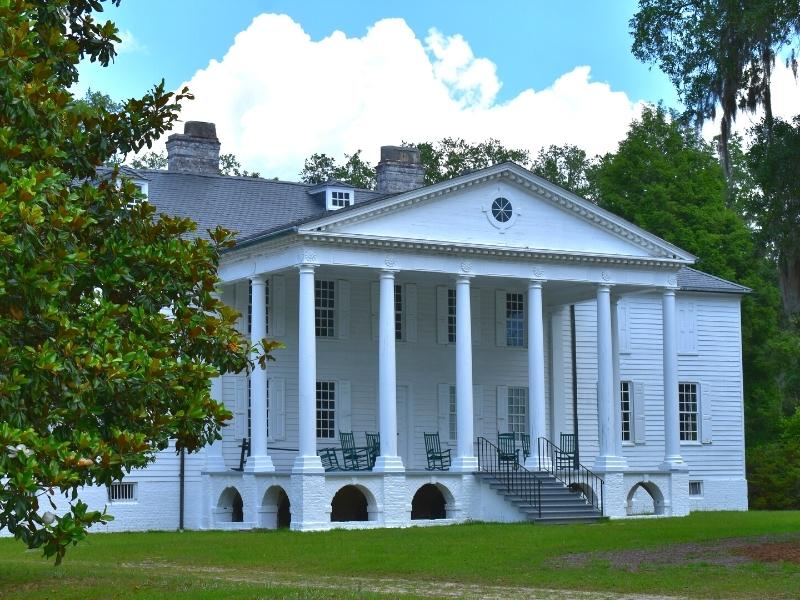
The height and width of the screenshot is (600, 800). In order to click on window shutters in this screenshot , I will do `click(709, 426)`, `click(638, 431)`.